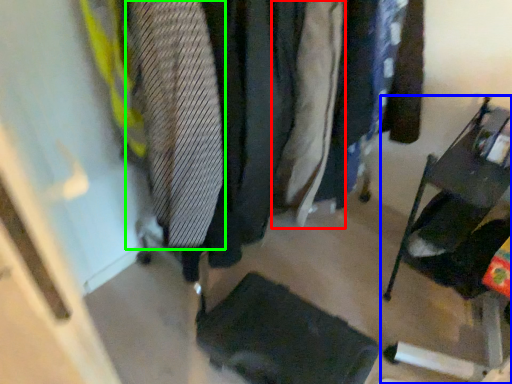
Question: Considering the real-world distances, which object is closest to clothing (highlighted by a red box)? furniture (highlighted by a blue box) or tie (highlighted by a green box).

Choices:
 (A) furniture
 (B) tie

Answer: (B)